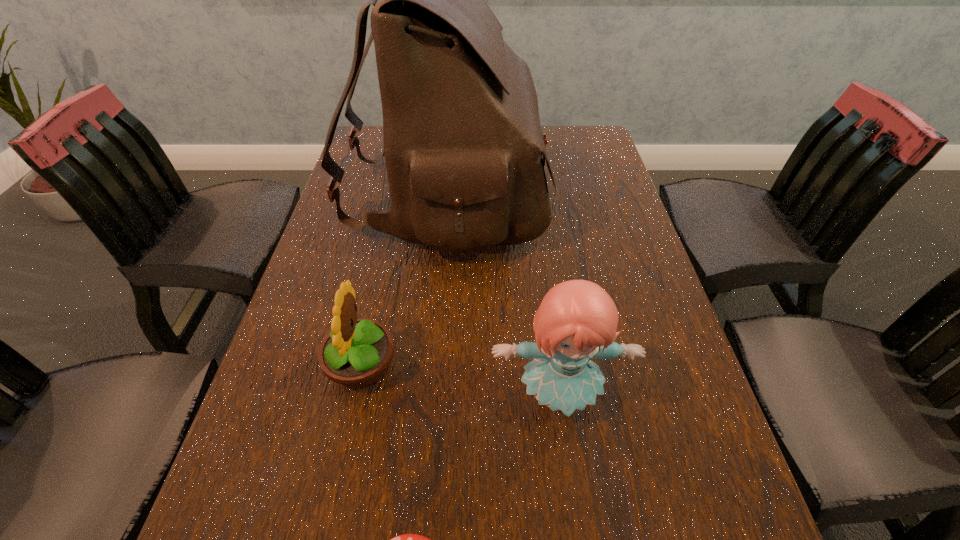
Where is `the tallest object`? This screenshot has width=960, height=540. the tallest object is located at coordinates (463, 146).

Identify the location of satchel. This screenshot has height=540, width=960. (463, 146).

Find the location of a particular element. doll is located at coordinates (577, 320).

In order to click on the second shortest object in this screenshot , I will do `click(356, 353)`.

This screenshot has height=540, width=960. I want to click on blank space located 0.170m on the front flap of the satchel, so click(603, 194).

Where is `vacant space located 0.050m on the front-facing side of the doll`? This screenshot has height=540, width=960. vacant space located 0.050m on the front-facing side of the doll is located at coordinates (567, 463).

Where is `vacant region located on the face of the third tallest object`? The height and width of the screenshot is (540, 960). vacant region located on the face of the third tallest object is located at coordinates (556, 366).

The width and height of the screenshot is (960, 540). In order to click on object located at the far edge in this screenshot , I will do `click(463, 146)`.

I want to click on satchel that is at the left edge, so click(463, 146).

Where is `sunflower situated at the left edge`? The width and height of the screenshot is (960, 540). sunflower situated at the left edge is located at coordinates (356, 353).